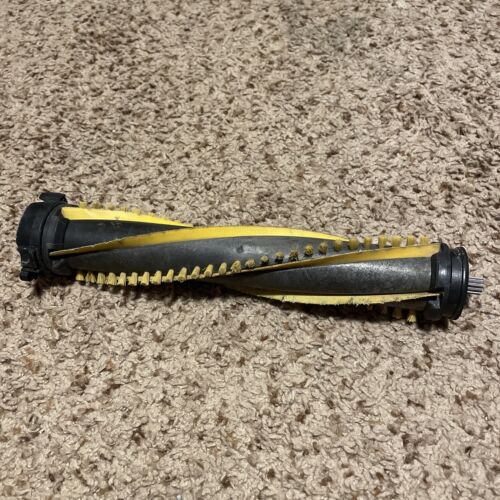
Locate an element on the screen. Image resolution: width=500 pixels, height=500 pixels. empty space on carpet is located at coordinates (41, 58), (271, 314), (153, 437), (69, 398), (418, 438), (450, 84), (386, 161), (96, 101), (63, 132).